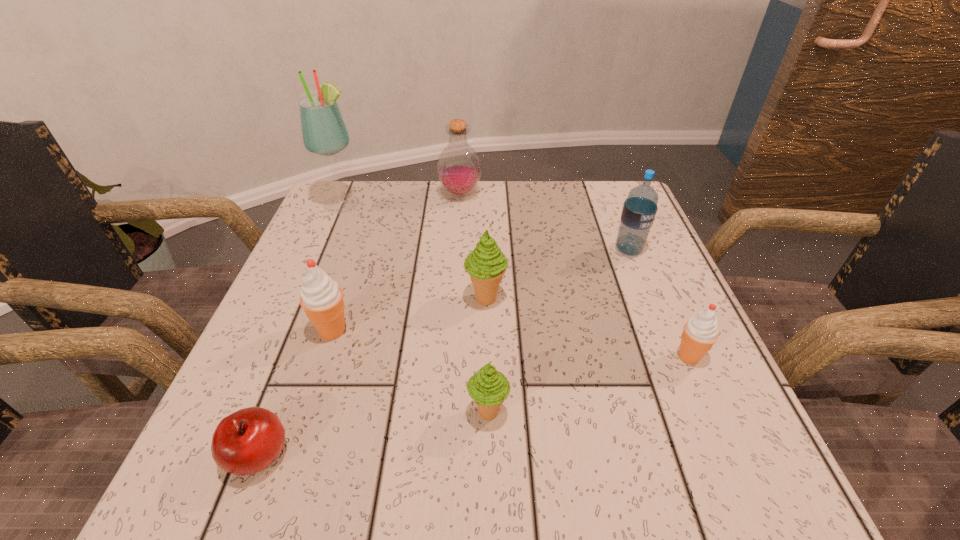
At what (x,y) coordinates should I click in order to perform the action: click on vacant point located between the left red icecream and the bottle. Please return your answer as a coordinate pair (x, y). The image size is (960, 540). Looking at the image, I should click on (396, 262).

Where is `empty space that is in between the rightmost icecream and the purple bottle`? The height and width of the screenshot is (540, 960). empty space that is in between the rightmost icecream and the purple bottle is located at coordinates (574, 275).

This screenshot has height=540, width=960. Identify the location of vacant space that's between the bottle and the right red icecream. (574, 275).

You are a GUI agent. You are given a task and a screenshot of the screen. Output one action in this format:
    pyautogui.click(x=<x>, y=<y>)
    Task: Click on the free point between the blue water bottle and the right red icecream
    The width and height of the screenshot is (960, 540).
    Given the screenshot: What is the action you would take?
    pyautogui.click(x=659, y=303)

This screenshot has width=960, height=540. I want to click on free space between the apple and the rightmost icecream, so click(474, 406).

Where is `free point between the smaller green icecream and the third farthest object`? This screenshot has height=540, width=960. free point between the smaller green icecream and the third farthest object is located at coordinates (559, 332).

At what (x,y) coordinates should I click in order to perform the action: click on free area in between the shortest object and the right red icecream. Please return your answer as a coordinate pair (x, y). Looking at the image, I should click on (474, 406).

This screenshot has width=960, height=540. What are the coordinates of `the seventh closest object to the purple bottle` in the screenshot? It's located at (245, 442).

Locate an element on the screen. The width and height of the screenshot is (960, 540). object that stands as the fourth closest to the apple is located at coordinates (324, 132).

Where is `icecream object that ranks as the second closest to the smaller green icecream`? icecream object that ranks as the second closest to the smaller green icecream is located at coordinates (321, 297).